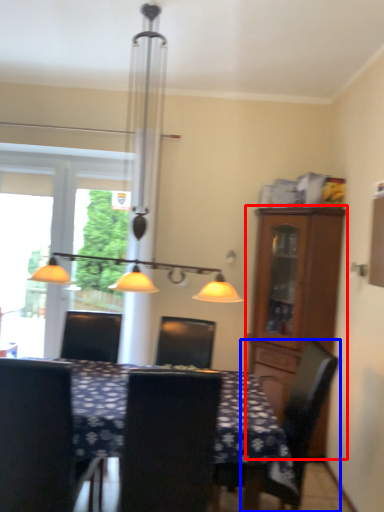
Question: Which object appears farthest to the camera in this image, cabinetry (highlighted by a red box) or chair (highlighted by a blue box)?

Choices:
 (A) cabinetry
 (B) chair

Answer: (A)